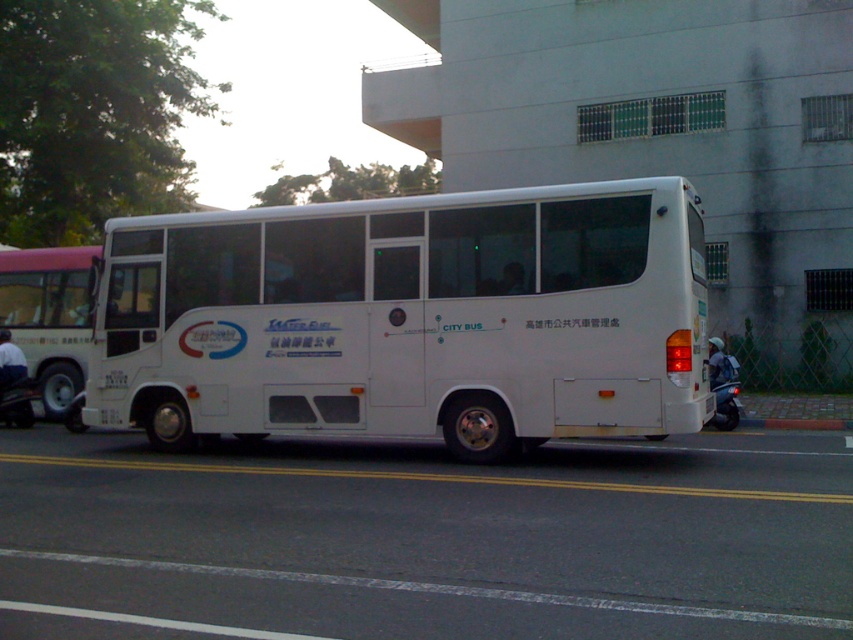
Question: Is white matte bus at center to the left of white matte bus at left from the viewer's perspective?

Choices:
 (A) no
 (B) yes

Answer: (A)

Question: Which object is farther from the camera taking this photo?

Choices:
 (A) white matte bus at center
 (B) white matte bus at left

Answer: (B)

Question: Does white matte bus at center have a larger size compared to white matte bus at left?

Choices:
 (A) no
 (B) yes

Answer: (A)

Question: Does white matte bus at center appear under white matte bus at left?

Choices:
 (A) no
 (B) yes

Answer: (B)